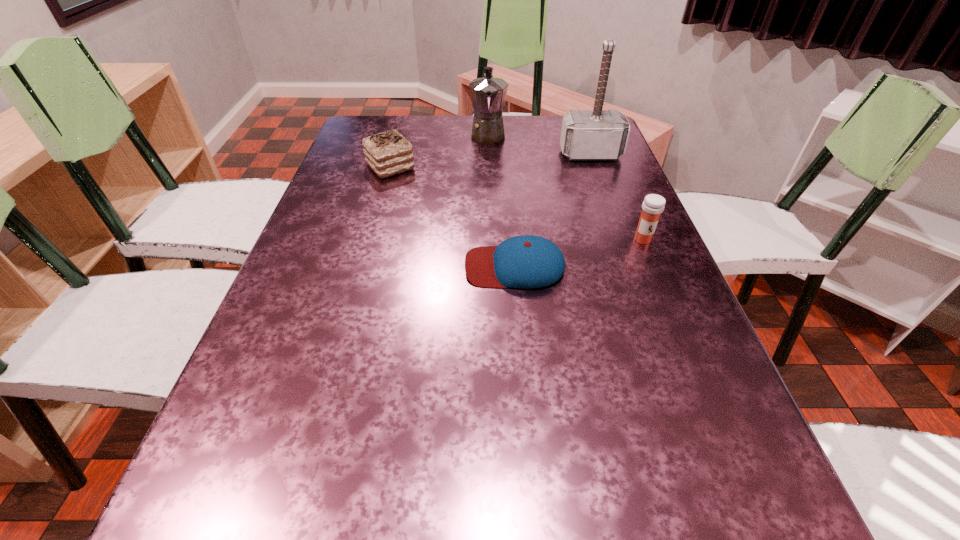
Where is `vacant space located with the bill of the shortest object facing forward`? vacant space located with the bill of the shortest object facing forward is located at coordinates (332, 266).

Identify the location of free region located with the bill of the shortest object facing forward. The width and height of the screenshot is (960, 540). (405, 266).

Where is `hammer that is positioned at the far edge`? hammer that is positioned at the far edge is located at coordinates (597, 134).

The width and height of the screenshot is (960, 540). I want to click on coffeepot positioned at the far edge, so click(488, 94).

Identify the location of object that is at the left edge. (388, 153).

Where is `hammer at the right edge`? Image resolution: width=960 pixels, height=540 pixels. hammer at the right edge is located at coordinates (597, 134).

Locate an element on the screen. Image resolution: width=960 pixels, height=540 pixels. medicine that is at the right edge is located at coordinates (653, 205).

Find the location of a particular element. object situated at the far right corner is located at coordinates (597, 134).

The image size is (960, 540). Find the location of `vacant space at the far edge`. vacant space at the far edge is located at coordinates (445, 132).

Where is `vacant space at the left edge of the desktop`? Image resolution: width=960 pixels, height=540 pixels. vacant space at the left edge of the desktop is located at coordinates (300, 484).